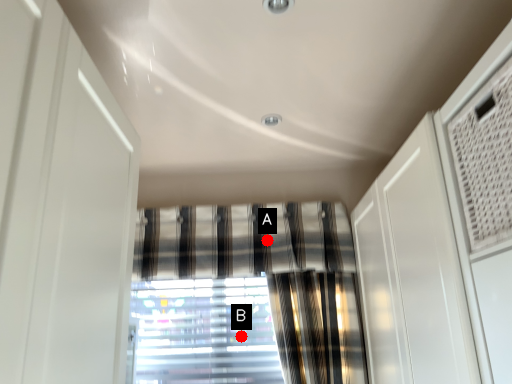
Question: Two points are circled on the image, labeled by A and B beside each circle. Which point is farther to the camera?

Choices:
 (A) A is further
 (B) B is further

Answer: (B)